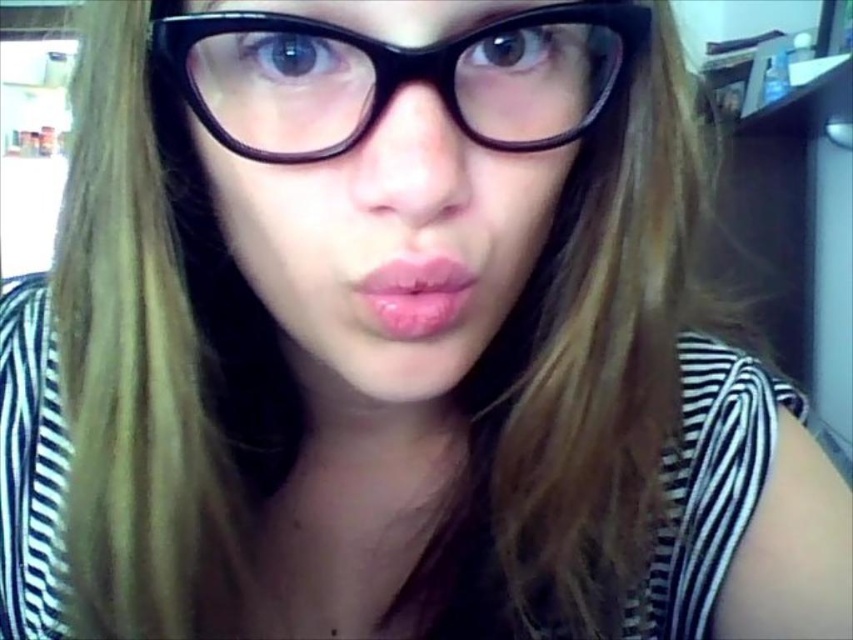
Is black matte glasses at center positioned behind pink glossy lips at center?

No, black matte glasses at center is closer to the viewer.

This screenshot has height=640, width=853. What do you see at coordinates (390, 243) in the screenshot?
I see `black matte glasses at center` at bounding box center [390, 243].

Which is behind, point (480, 332) or point (386, 314)?

Point (480, 332)

Where is `black matte glasses at center`? The height and width of the screenshot is (640, 853). black matte glasses at center is located at coordinates (390, 243).

Which is more to the left, black matte glasses at center or black plastic glasses at center?

black matte glasses at center

Which is more to the right, black matte glasses at center or black plastic glasses at center?

black plastic glasses at center is more to the right.

Is point (407, 392) positioned in front of point (480, 140)?

No, (407, 392) is behind (480, 140).

The height and width of the screenshot is (640, 853). What are the coordinates of `black matte glasses at center` in the screenshot? It's located at (390, 243).

Is point (544, 40) closer to viewer compared to point (399, 333)?

No, (544, 40) is behind (399, 333).

Can you confirm if black plastic glasses at center is positioned below pink glossy lips at center?

Incorrect, black plastic glasses at center is not positioned below pink glossy lips at center.

Between point (292, 108) and point (384, 301), which one is positioned in front?

Positioned in front is point (292, 108).

Find the location of a particular element. The width and height of the screenshot is (853, 640). black plastic glasses at center is located at coordinates (395, 76).